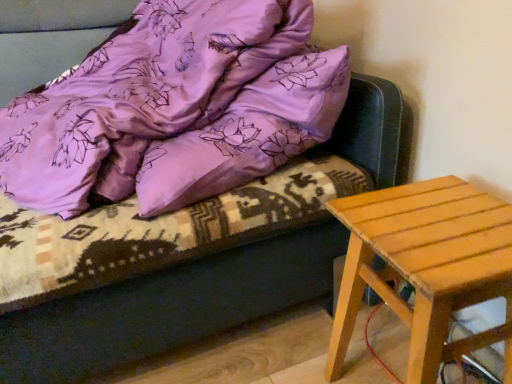
Question: Is wooden stool at right surrounding satin purple blanket at upper left?

Choices:
 (A) yes
 (B) no

Answer: (B)

Question: Can you confirm if wooden stool at right is thinner than satin purple blanket at upper left?

Choices:
 (A) yes
 (B) no

Answer: (A)

Question: Does wooden stool at right lie behind satin purple blanket at upper left?

Choices:
 (A) no
 (B) yes

Answer: (B)

Question: Is wooden stool at right at the left side of satin purple blanket at upper left?

Choices:
 (A) yes
 (B) no

Answer: (B)

Question: Is wooden stool at right wider than satin purple blanket at upper left?

Choices:
 (A) no
 (B) yes

Answer: (A)

Question: Considering the relative sizes of wooden stool at right and satin purple blanket at upper left in the image provided, is wooden stool at right taller than satin purple blanket at upper left?

Choices:
 (A) no
 (B) yes

Answer: (A)

Question: From the image's perspective, is satin purple blanket at upper left located beneath wooden stool at right?

Choices:
 (A) yes
 (B) no

Answer: (B)

Question: Is satin purple blanket at upper left to the right of wooden stool at right from the viewer's perspective?

Choices:
 (A) yes
 (B) no

Answer: (B)

Question: Can you confirm if satin purple blanket at upper left is shorter than wooden stool at right?

Choices:
 (A) no
 (B) yes

Answer: (A)

Question: Does satin purple blanket at upper left lie in front of wooden stool at right?

Choices:
 (A) no
 (B) yes

Answer: (B)

Question: Is satin purple blanket at upper left not inside wooden stool at right?

Choices:
 (A) yes
 (B) no

Answer: (A)

Question: From a real-world perspective, is satin purple blanket at upper left below wooden stool at right?

Choices:
 (A) yes
 (B) no

Answer: (B)

Question: Does point (52, 188) appear closer or farther from the camera than point (462, 269)?

Choices:
 (A) farther
 (B) closer

Answer: (A)